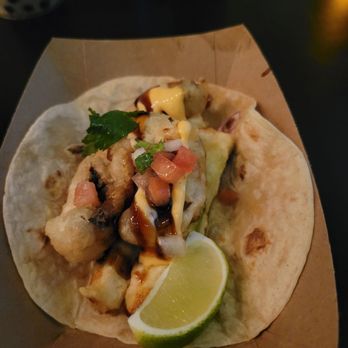
This screenshot has height=348, width=348. What are the coordinates of `light in the background` in the screenshot? It's located at (334, 22).